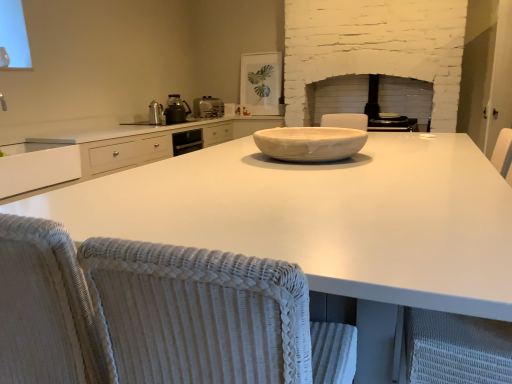
Question: Is white woven armchair at right to the right of satin silver toaster at upper center from the viewer's perspective?

Choices:
 (A) no
 (B) yes

Answer: (B)

Question: Is white woven armchair at right far from satin silver toaster at upper center?

Choices:
 (A) no
 (B) yes

Answer: (B)

Question: Does white woven armchair at right come behind satin silver toaster at upper center?

Choices:
 (A) no
 (B) yes

Answer: (A)

Question: Does white woven armchair at right have a larger size compared to satin silver toaster at upper center?

Choices:
 (A) yes
 (B) no

Answer: (A)

Question: Does white woven armchair at right have a lesser width compared to satin silver toaster at upper center?

Choices:
 (A) yes
 (B) no

Answer: (B)

Question: Considering the positions of white marble bowl at center and white woven armchair at right in the image, is white marble bowl at center wider or thinner than white woven armchair at right?

Choices:
 (A) wide
 (B) thin

Answer: (A)

Question: Does point (337, 150) appear closer or farther from the camera than point (438, 314)?

Choices:
 (A) farther
 (B) closer

Answer: (A)

Question: From the image's perspective, is white marble bowl at center located above or below white woven armchair at right?

Choices:
 (A) below
 (B) above

Answer: (B)

Question: In terms of height, does white marble bowl at center look taller or shorter compared to white woven armchair at right?

Choices:
 (A) tall
 (B) short

Answer: (B)

Question: Is white marble bowl at center inside or outside of metallic silver kettle at center-left, which is the 1th appliance in left-to-right order?

Choices:
 (A) outside
 (B) inside

Answer: (A)

Question: Considering the relative positions of white marble bowl at center and metallic silver kettle at center-left, placed as the 4th appliance when sorted from right to left, in the image provided, is white marble bowl at center to the left or to the right of metallic silver kettle at center-left, placed as the 4th appliance when sorted from right to left,?

Choices:
 (A) right
 (B) left

Answer: (A)

Question: From the image's perspective, is white marble bowl at center located above or below metallic silver kettle at center-left, placed as the 4th appliance when sorted from right to left?

Choices:
 (A) above
 (B) below

Answer: (B)

Question: Considering the positions of white marble bowl at center and metallic silver kettle at center-left, which is the 1th appliance in left-to-right order, in the image, is white marble bowl at center taller or shorter than metallic silver kettle at center-left, which is the 1th appliance in left-to-right order,?

Choices:
 (A) short
 (B) tall

Answer: (A)

Question: From the image's perspective, is matte black toaster at center, placed as the third appliance when sorted from back to front, above or below metallic silver kettle at center-left, the 1th appliance viewed from the front?

Choices:
 (A) below
 (B) above

Answer: (A)

Question: Is matte black toaster at center, which is the 4th appliance from left to right, in front of or behind metallic silver kettle at center-left, the fourth appliance from the back, in the image?

Choices:
 (A) behind
 (B) front

Answer: (A)